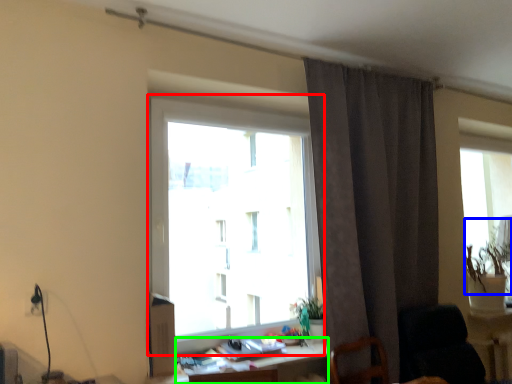
Question: Which is nearer to the window (highlighted by a red box)? plant (highlighted by a blue box) or table (highlighted by a green box).

Choices:
 (A) plant
 (B) table

Answer: (B)